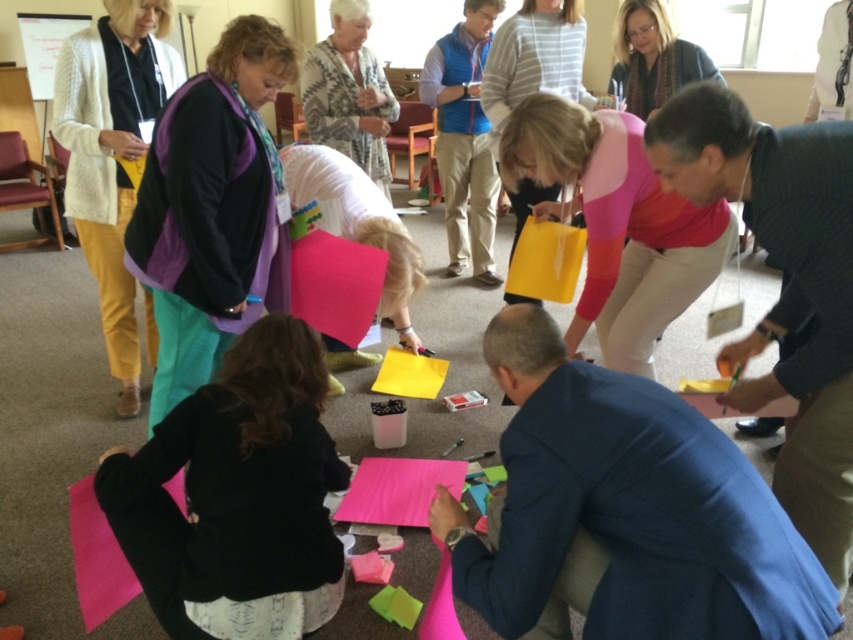
You are standing at the origin point of the room. There is a point marked at coordinates (618, 224). What color fabric is located at that point?

The point at coordinates (618, 224) has pink fabric at center.

You are standing in the middle of the room and want to place a new object at the same 2D location as the pink fabric at center. What are the coordinates you should aim for?

The coordinates you should aim for are point (x=618, y=224), as that is the 2D location of the pink fabric at center.